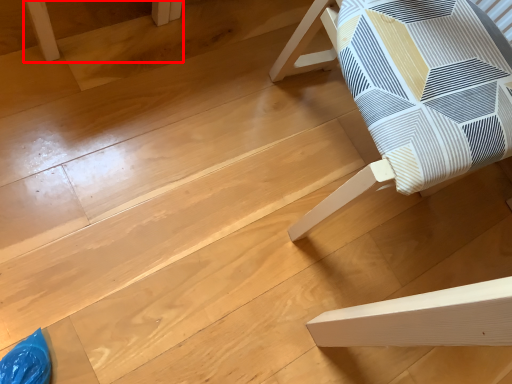
Question: From the image's perspective, what is the correct spatial positioning of furniture (annotated by the red box) in reference to furniture?

Choices:
 (A) below
 (B) above

Answer: (B)